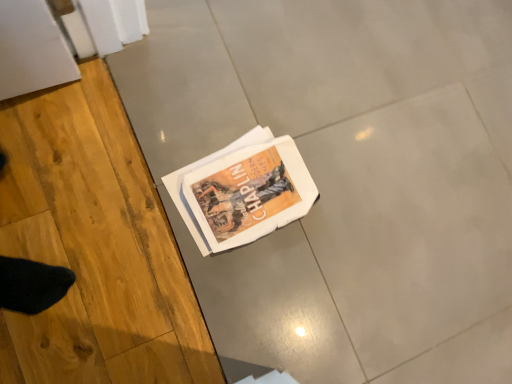
Find the location of a particular element. Image resolution: width=512 pixels, height=384 pixels. unoccupied region to the right of orange paper magazine at center is located at coordinates (327, 267).